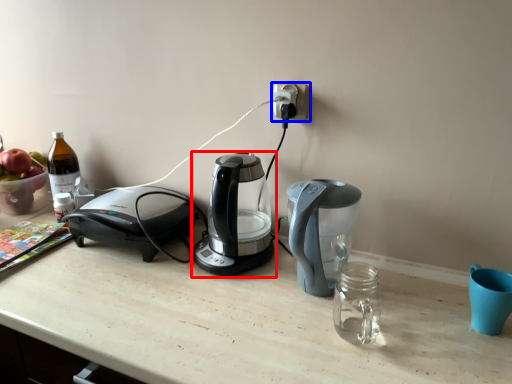
Question: Which point is closer to the camera, coffee maker (highlighted by a red box) or power plugs and sockets (highlighted by a blue box)?

Choices:
 (A) coffee maker
 (B) power plugs and sockets

Answer: (A)